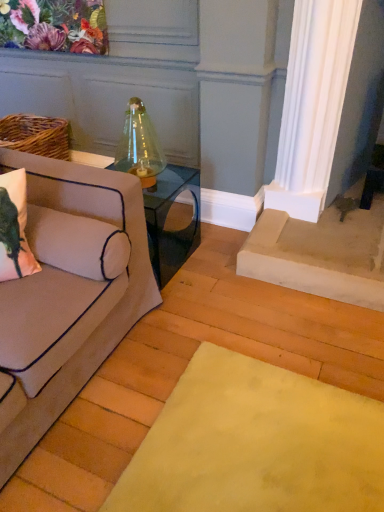
Locate an element on the screen. The height and width of the screenshot is (512, 384). vacant area that lies in front of clear glass table at center is located at coordinates (181, 308).